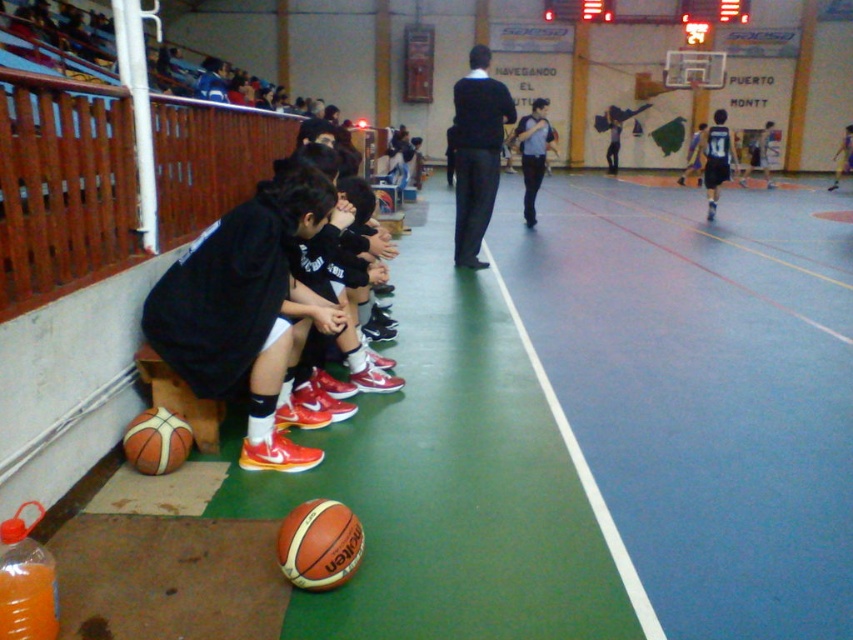
The image size is (853, 640). I want to click on black matte jacket at center, so click(476, 152).

Can you confirm if black matte jacket at center is positioned above green rubber line at center?

Yes.

Where is `black matte jacket at center`? This screenshot has height=640, width=853. black matte jacket at center is located at coordinates (476, 152).

At what (x,y) coordinates should I click in order to perform the action: click on black matte jacket at center. Please return your answer as a coordinate pair (x, y). Image resolution: width=853 pixels, height=640 pixels. Looking at the image, I should click on (476, 152).

Between point (498, 132) and point (303, 524), which one is positioned behind?

Positioned behind is point (498, 132).

Between point (503, 116) and point (311, 538), which one is positioned in front?

Point (311, 538)

Where is `black matte jacket at center`? The width and height of the screenshot is (853, 640). black matte jacket at center is located at coordinates (476, 152).

Does green rubber line at center come behind leather textured basketball at lower left?

Yes.

Who is positioned more to the left, green rubber line at center or leather textured basketball at lower left?

From the viewer's perspective, leather textured basketball at lower left appears more on the left side.

What do you see at coordinates (584, 474) in the screenshot?
I see `green rubber line at center` at bounding box center [584, 474].

Where is `green rubber line at center`? The height and width of the screenshot is (640, 853). green rubber line at center is located at coordinates (584, 474).